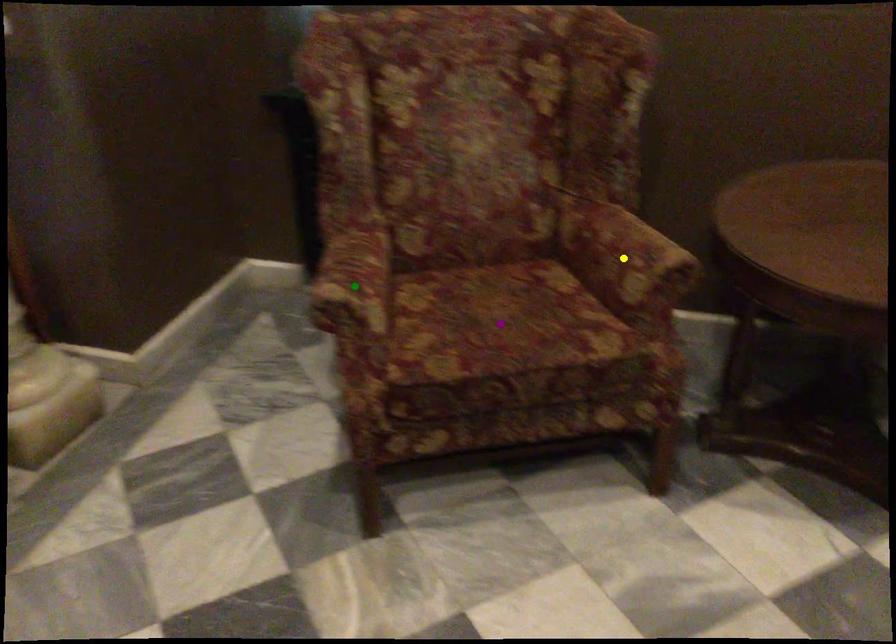
Order these from nearest to farthest:
green point | yellow point | purple point

1. green point
2. yellow point
3. purple point